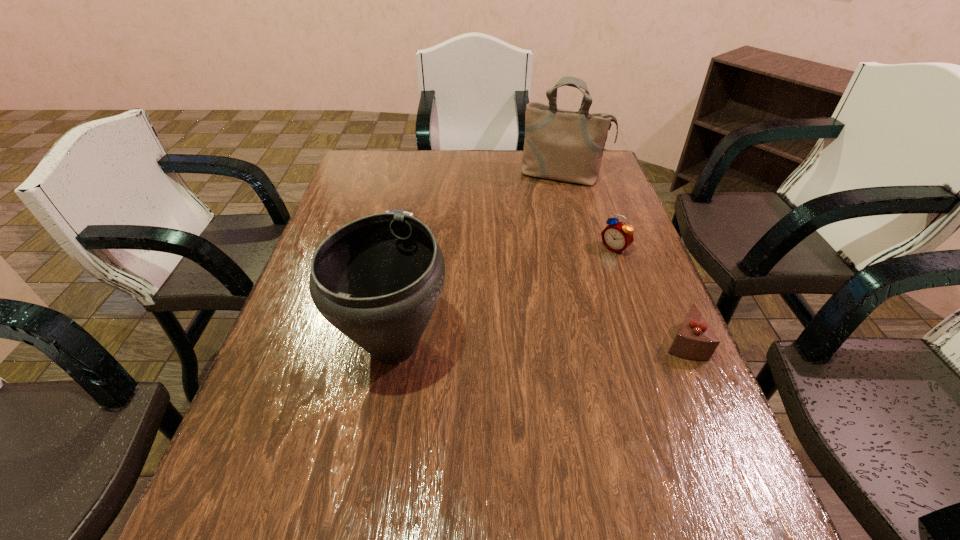
This screenshot has height=540, width=960. I want to click on vacant area located 0.250m on the front-facing side of the goggles, so click(x=465, y=286).

At what (x,y) coordinates should I click in order to perform the action: click on free space located 0.210m on the front-facing side of the third shortest object. Please return your answer as a coordinate pair (x, y). The width and height of the screenshot is (960, 540). Looking at the image, I should click on (559, 294).

This screenshot has width=960, height=540. Find the location of `vacant region located on the front-facing side of the third shortest object`. vacant region located on the front-facing side of the third shortest object is located at coordinates (576, 280).

The height and width of the screenshot is (540, 960). In order to click on blank space located on the front-facing side of the third shortest object in this screenshot , I will do `click(571, 284)`.

Locate an element on the screen. The width and height of the screenshot is (960, 540). free space located 0.180m on the front-facing side of the farthest object is located at coordinates (546, 218).

You are a GUI agent. You are given a task and a screenshot of the screen. Output one action in this format:
    pyautogui.click(x=<x>, y=<y>)
    Task: Click on the free spot located on the front-facing side of the farthest object
    
    Given the screenshot: What is the action you would take?
    pyautogui.click(x=544, y=221)

You are a GUI agent. You are given a task and a screenshot of the screen. Output one action in this format:
    pyautogui.click(x=<x>, y=<y>)
    Task: Click on the vacant space located on the front-facing side of the farthest object
    Image resolution: width=960 pixels, height=540 pixels.
    Given the screenshot: What is the action you would take?
    pyautogui.click(x=537, y=248)

I want to click on object that is at the far edge, so click(562, 145).

Identify the location of urn located in the left edge section of the desktop. The height and width of the screenshot is (540, 960). (377, 279).

Locate an element on the screen. Image resolution: width=960 pixels, height=540 pixels. goggles that is positioned at the left edge is located at coordinates (397, 211).